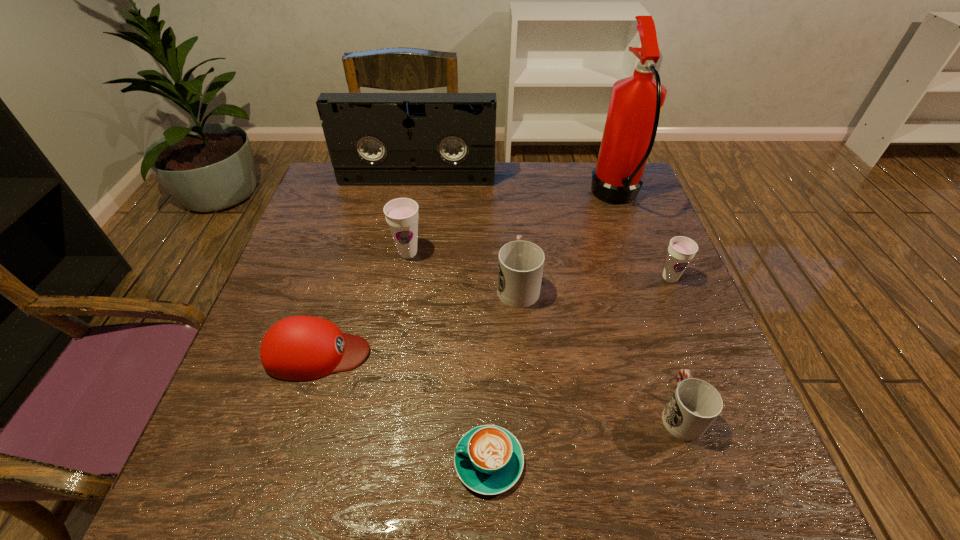
Find the location of a particular element. vacant space at the near edge of the desktop is located at coordinates coord(600,473).

This screenshot has height=540, width=960. In the image, there is a desktop. In order to click on vacant space at the left edge in this screenshot , I will do `click(302, 282)`.

You are a GUI agent. You are given a task and a screenshot of the screen. Output one action in this format:
    pyautogui.click(x=<x>, y=<y>)
    Task: Click on the free location at the right edge
    
    Given the screenshot: What is the action you would take?
    pyautogui.click(x=649, y=222)

Identify the location of free region at the far right corner of the desktop. The height and width of the screenshot is (540, 960). (590, 161).

At what (x,y) coordinates should I click in order to perform the action: click on vacant area that lies between the nearer purple cup and the videotape. Please return your answer as a coordinate pair (x, y). This screenshot has height=540, width=960. Looking at the image, I should click on (543, 229).

At what (x,y) coordinates should I click in order to perform the action: click on free space between the gray videotape and the second cup from right to left. Please return your answer as a coordinate pair (x, y). The width and height of the screenshot is (960, 540). Looking at the image, I should click on (549, 296).

This screenshot has height=540, width=960. I want to click on free spot between the videotape and the turquoise cappuccino, so click(x=453, y=321).

At what (x,y) coordinates should I click in order to perform the action: click on free spot between the smaller purple cup and the right red cup. Please return your answer as a coordinate pair (x, y). Looking at the image, I should click on click(x=675, y=346).

Locate an element on the screen. empty space that is in between the cappuccino and the gray videotape is located at coordinates (453, 321).

At what (x,y) coordinates should I click in order to perform the action: click on free space between the cappuccino and the gray videotape. Please return your answer as a coordinate pair (x, y). The height and width of the screenshot is (540, 960). Looking at the image, I should click on (453, 321).